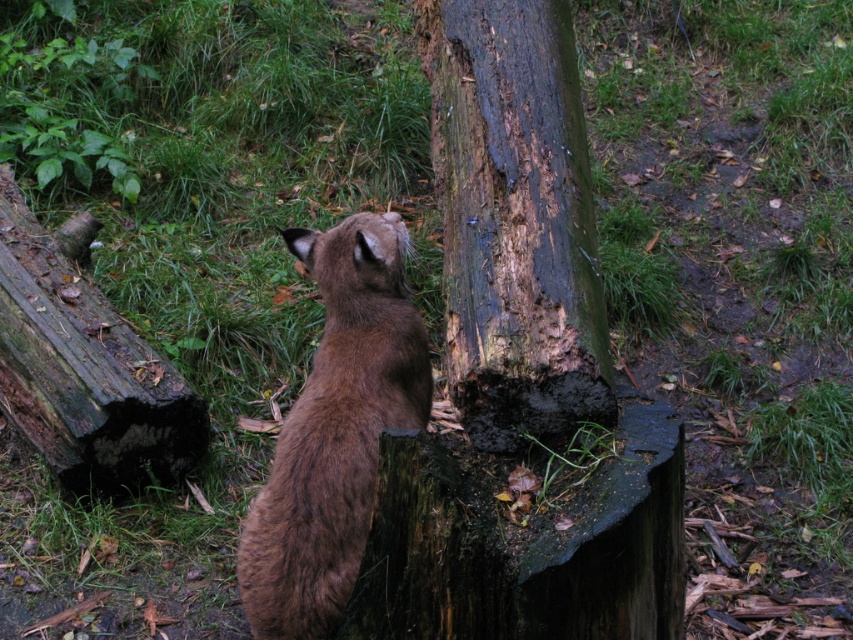
You are a photographer trying to capture the brown furry cat at center and the dark brown wood at center in the same frame. Based on their sizes, which object will appear larger in your photo?

The dark brown wood at center appears larger in the photo because its width is greater than that of the brown furry cat at center.

You are standing in the forest scene shown in the image. You need to locate the dark brown wood at center. What are its coordinates on the image?

The dark brown wood at center is located at coordinates [515,220].

You are a hiker who wants to place a small backpack between the dark brown wood at center and the brown furry cat at center. According to the scene, which object should you place the backpack next to on the left side?

The dark brown wood at center is positioned on the right side of brown furry cat at center, so you should place the backpack next to the brown furry cat at center on its left side.